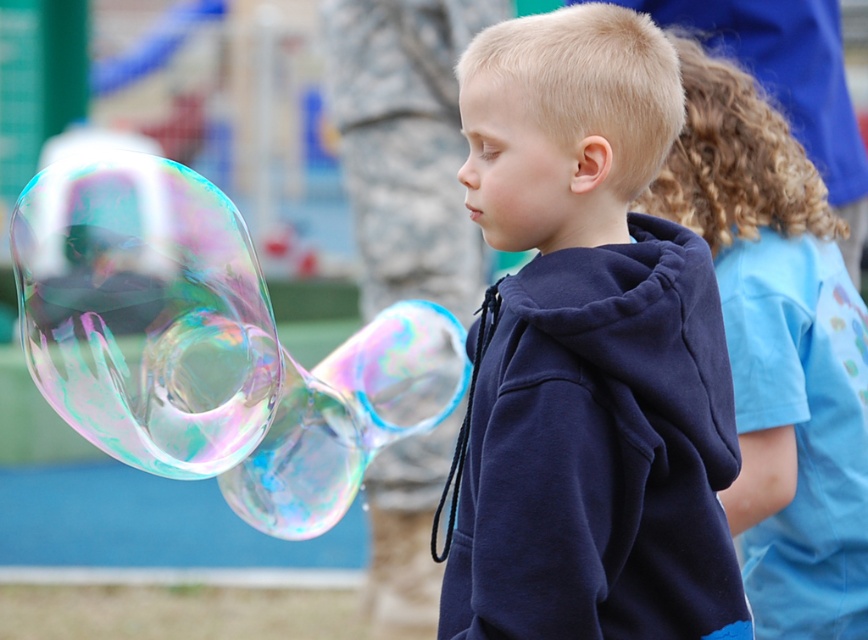
Question: Which is farther from the navy blue hoodie at center?

Choices:
 (A) blue cotton shirt at center
 (B) transparent iridescent bubble at left
 (C) transparent iridescent bubbles at left

Answer: (C)

Question: Where is transparent iridescent bubble at left located in relation to transparent iridescent bubbles at left in the image?

Choices:
 (A) above
 (B) below

Answer: (B)

Question: Can you confirm if navy blue hoodie at center is positioned below transparent iridescent bubbles at left?

Choices:
 (A) yes
 (B) no

Answer: (A)

Question: Among these objects, which one is nearest to the camera?

Choices:
 (A) transparent iridescent bubble at left
 (B) navy blue hoodie at center
 (C) blue cotton shirt at center

Answer: (B)

Question: Is navy blue hoodie at center further to the viewer compared to transparent iridescent bubbles at left?

Choices:
 (A) yes
 (B) no

Answer: (B)

Question: Considering the real-world distances, which object is farthest from the transparent iridescent bubble at left?

Choices:
 (A) transparent iridescent bubbles at left
 (B) blue cotton shirt at center
 (C) navy blue hoodie at center

Answer: (A)